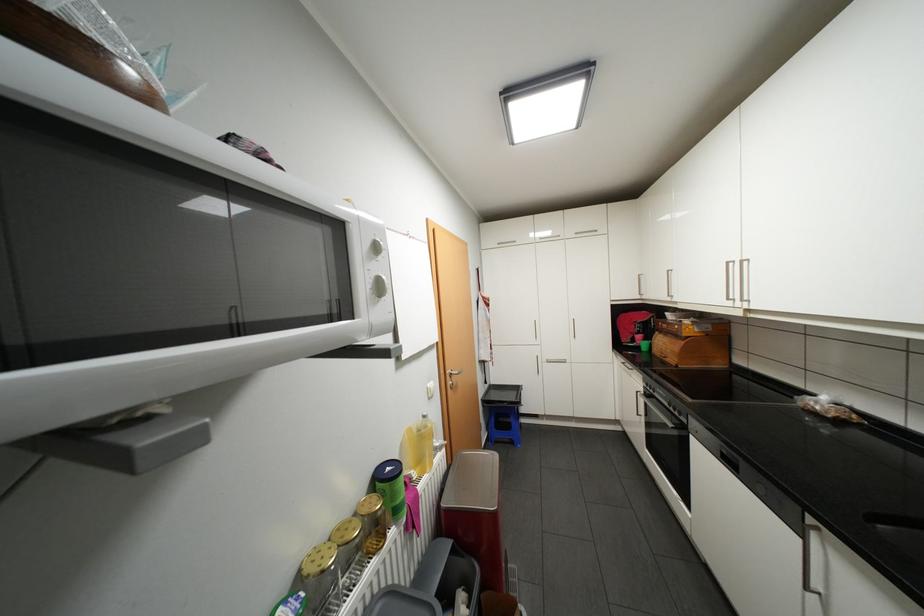
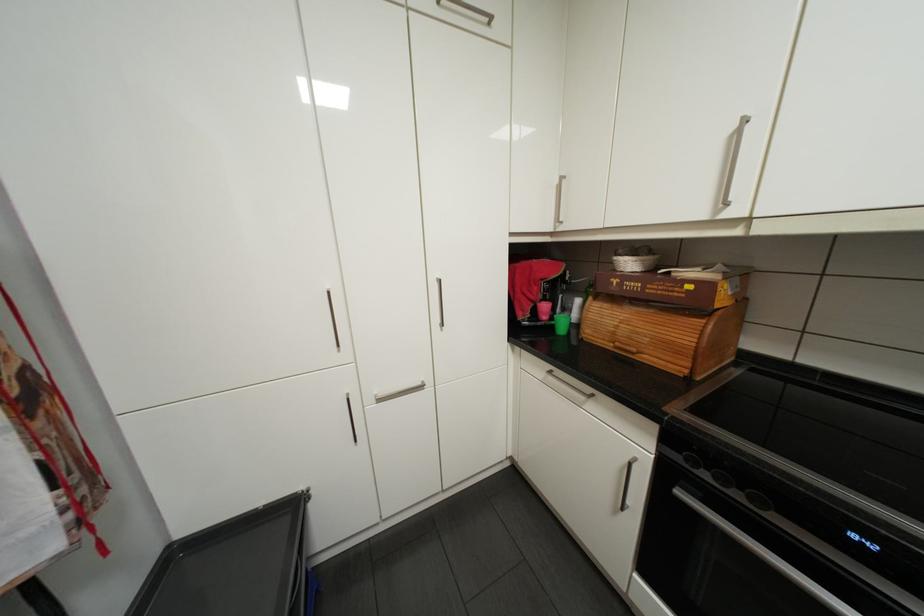
Where in the second image is the point corresponding to the point at 691,334 from the first image?

(725, 305)